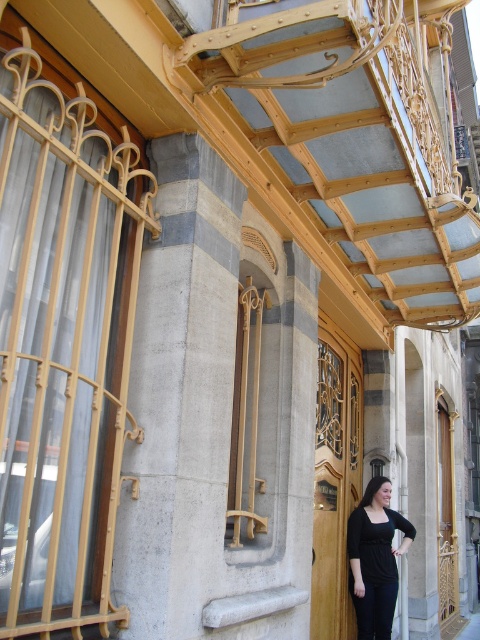
You are a fashion designer observing the image. You notice the gray stone column at center and the black matte dress at lower right. Which object is positioned higher in the image?

The gray stone column at center is located above the black matte dress at lower right, so it is positioned higher in the image.

You are a contractor assessing the building facade. You need to install a new light fixture that requires a mounting height of at least 3 meters. Given the gray stone column at center and the white concrete pavement at lower right, which object would be suitable for mounting the fixture?

The gray stone column at center is much taller than the white concrete pavement at lower right, so it would be suitable for mounting the light fixture at the required height of 3 meters.